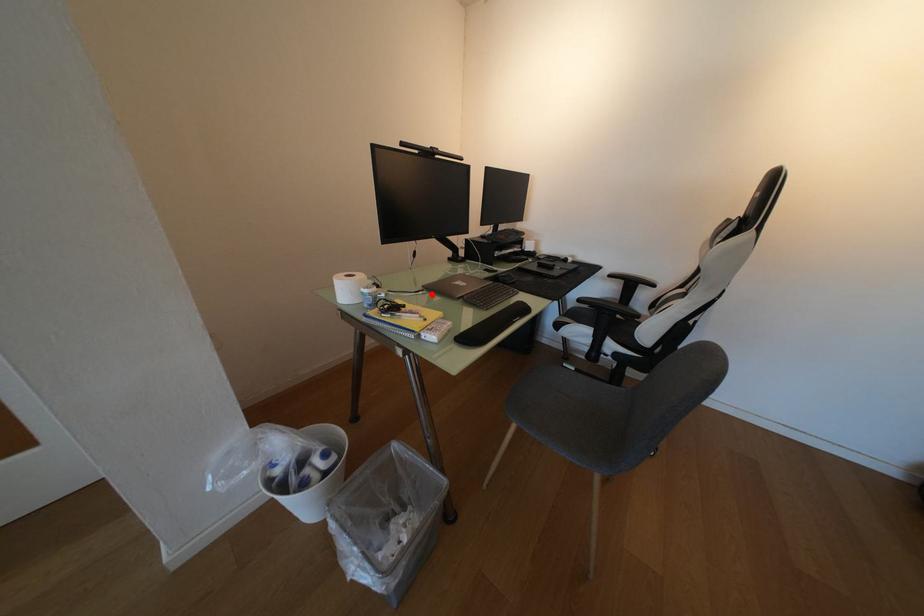
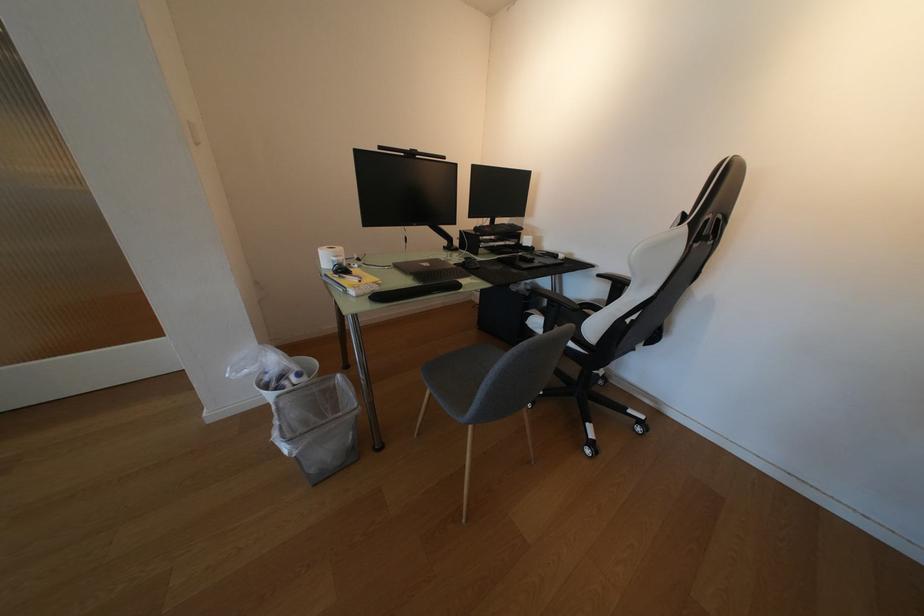
The point at the highlighted location is marked in the first image. Where is the corresponding point in the second image?

(397, 268)